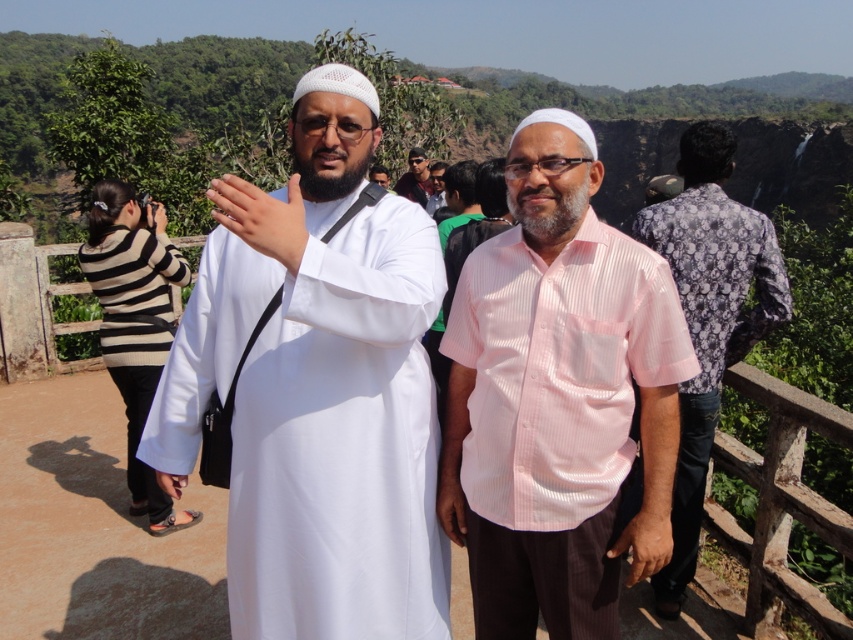
Question: Does white matte robe at center have a larger size compared to light pink shirt at center?

Choices:
 (A) no
 (B) yes

Answer: (B)

Question: Which point is closer to the camera taking this photo?

Choices:
 (A) (161, 477)
 (B) (405, 182)
 (C) (149, 218)

Answer: (A)

Question: Which object appears farthest from the camera in this image?

Choices:
 (A) pink striped shirt at center
 (B) striped sweater at left
 (C) matte white hand at center

Answer: (B)

Question: Is white matte robe at center thinner than matte white hand at center?

Choices:
 (A) yes
 (B) no

Answer: (B)

Question: Which point is farther to the camera?

Choices:
 (A) (238, 196)
 (B) (440, 496)

Answer: (B)

Question: Where is brown leather ring at lower right located in relation to brown leather hand at center in the image?

Choices:
 (A) below
 (B) above

Answer: (A)